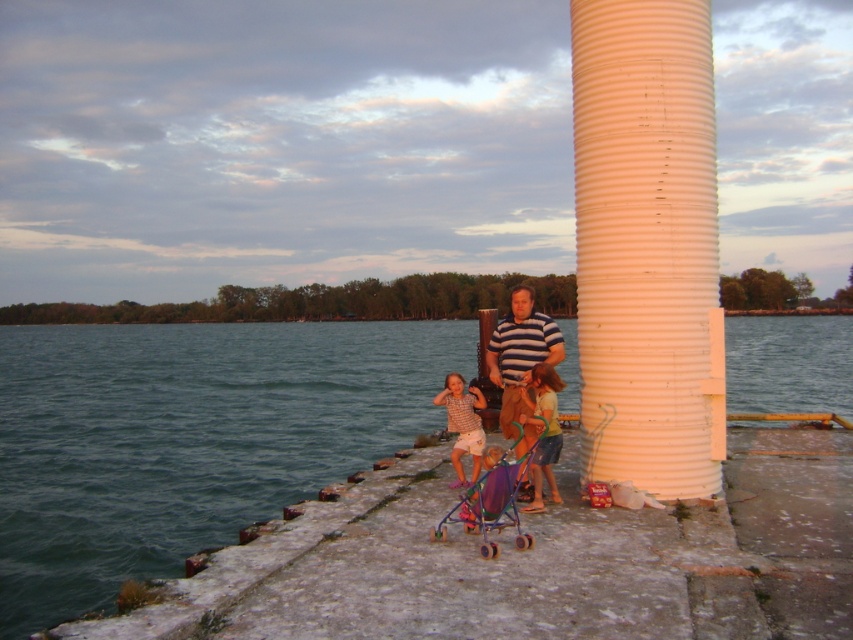
In the scene shown: Does green water at lower left lie in front of matte purple stroller at center?

No, green water at lower left is further to the viewer.

At what (x,y) coordinates should I click in order to perform the action: click on green water at lower left. Please return your answer as a coordinate pair (x, y). Image resolution: width=853 pixels, height=640 pixels. Looking at the image, I should click on (186, 440).

Does white ribbed cylinder at right come in front of striped cotton shirt at center?

That is False.

Locate an element on the screen. The width and height of the screenshot is (853, 640). white ribbed cylinder at right is located at coordinates (645, 241).

Between point (503, 454) and point (463, 436), which one is positioned behind?

Point (463, 436)

Can you confirm if metallic multicolored stroller at center is wider than plaid shirt at center?

Indeed, metallic multicolored stroller at center has a greater width compared to plaid shirt at center.

Image resolution: width=853 pixels, height=640 pixels. In order to click on metallic multicolored stroller at center in this screenshot , I will do `click(492, 502)`.

At what (x,y) coordinates should I click in order to perform the action: click on metallic multicolored stroller at center. Please return your answer as a coordinate pair (x, y). This screenshot has width=853, height=640. Looking at the image, I should click on (492, 502).